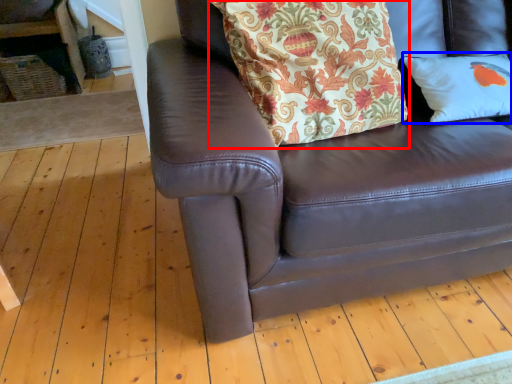
Question: Which point is further to the camera, blanket (highlighted by a red box) or pillow (highlighted by a blue box)?

Choices:
 (A) blanket
 (B) pillow

Answer: (B)